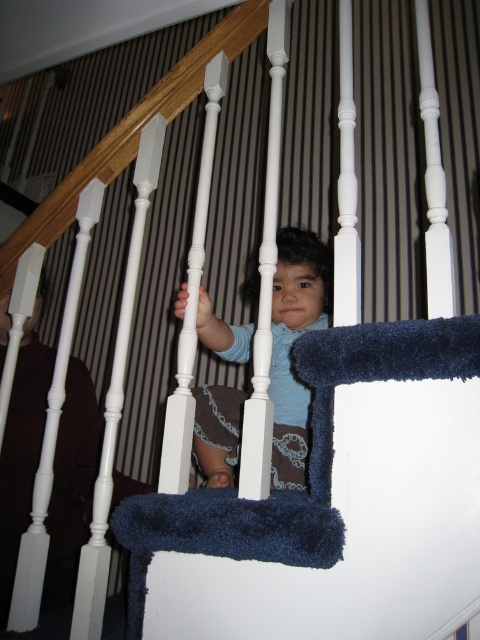
Between blue plush stair at center and matte blue shirt at center, which one appears on the right side from the viewer's perspective?

blue plush stair at center

Between point (317, 404) and point (296, 280), which one is positioned behind?

Positioned behind is point (296, 280).

Where is `blue plush stair at center`? This screenshot has height=640, width=480. blue plush stair at center is located at coordinates (311, 460).